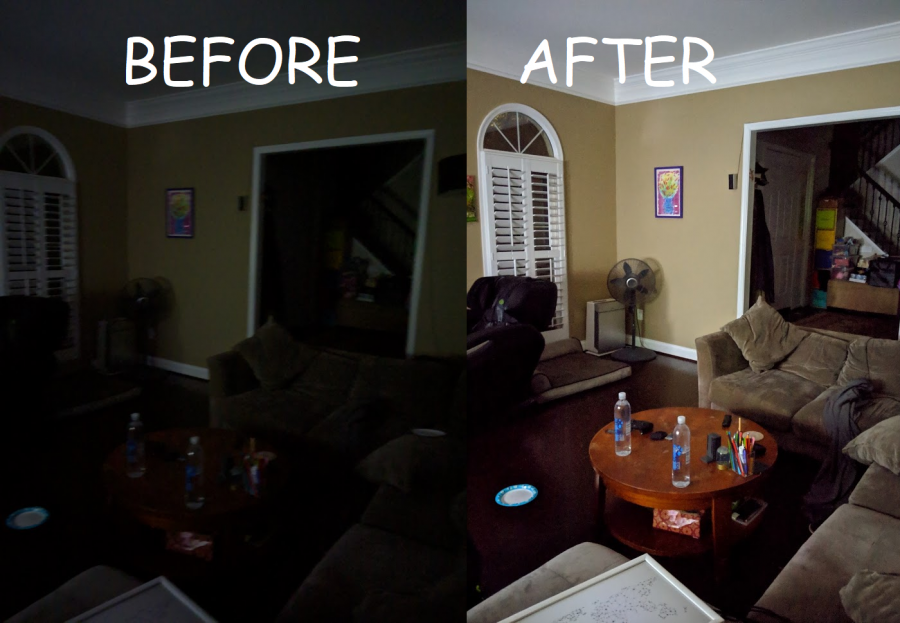
What are the coordinates of `shutters` in the screenshot? It's located at (501, 193), (545, 210), (549, 265), (508, 260), (54, 220), (28, 225), (27, 288), (48, 295).